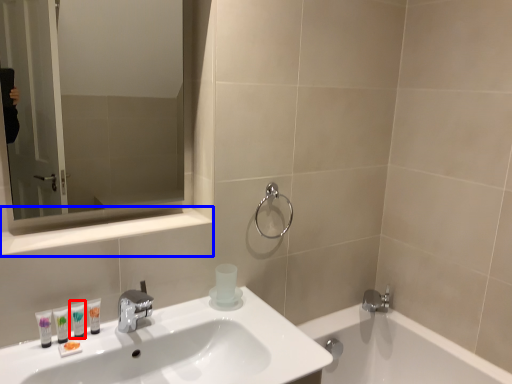
Question: Which point is further to the camera, mouthwash (highlighted by a red box) or balustrade (highlighted by a blue box)?

Choices:
 (A) mouthwash
 (B) balustrade

Answer: (A)